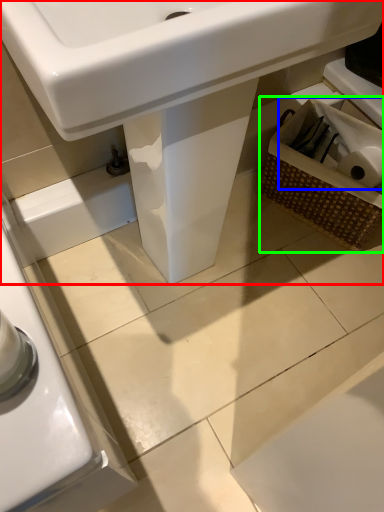
Question: Estimate the real-world distances between objects in this image. Which object is closer to sink (highlighted by a red box), toilet paper (highlighted by a blue box) or basket (highlighted by a green box)?

Choices:
 (A) toilet paper
 (B) basket

Answer: (B)